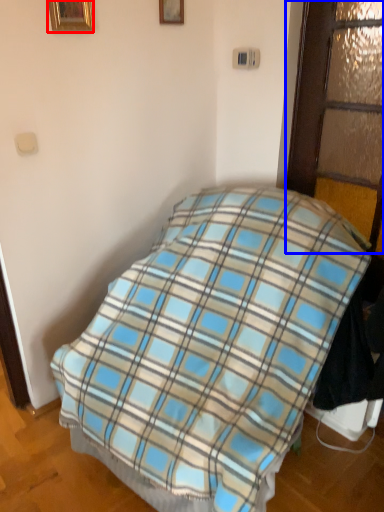
Question: Which object is closer to the camera taking this photo, picture frame (highlighted by a red box) or glass door (highlighted by a blue box)?

Choices:
 (A) picture frame
 (B) glass door

Answer: (B)